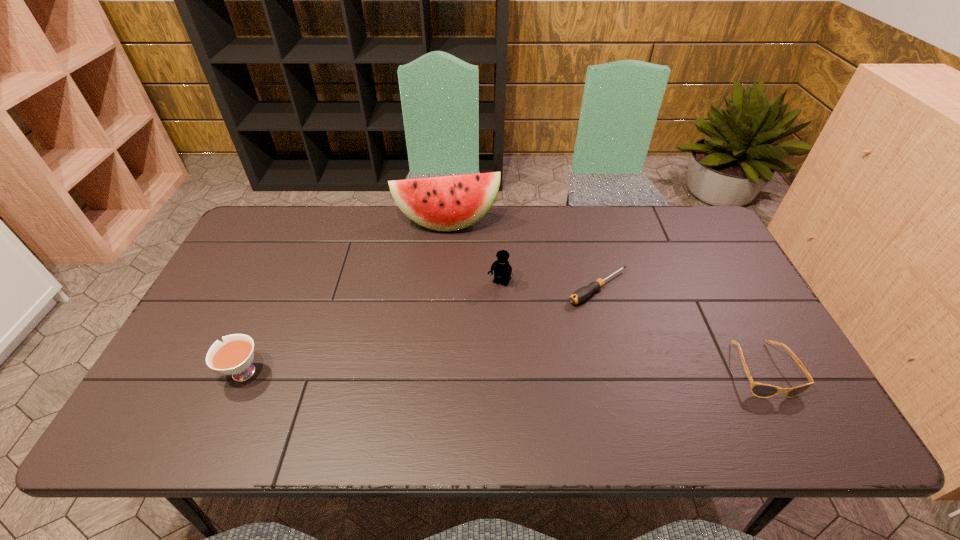
Find the location of `vacant point located on the front-facing side of the Lego`. vacant point located on the front-facing side of the Lego is located at coordinates (488, 305).

This screenshot has height=540, width=960. In order to click on free space located on the front-facing side of the Lego in this screenshot , I will do `click(458, 361)`.

At what (x,y) coordinates should I click in order to perform the action: click on vacant space situated 0.240m on the front-facing side of the Lego. Please return your answer as a coordinate pair (x, y). This screenshot has height=540, width=960. Looking at the image, I should click on (461, 355).

You are a GUI agent. You are given a task and a screenshot of the screen. Output one action in this format:
    pyautogui.click(x=<x>, y=<y>)
    Task: Click on the free region located at the tip of the screwdriver
    Image resolution: width=960 pixels, height=540 pixels.
    Given the screenshot: What is the action you would take?
    pyautogui.click(x=516, y=338)

I want to click on vacant space located at the tip of the screwdriver, so click(467, 370).

At what (x,y) coordinates should I click in order to perform the action: click on free space located 0.380m at the tip of the screwdriver. Please return your answer as a coordinate pair (x, y). This screenshot has width=960, height=540. Looking at the image, I should click on (467, 370).

This screenshot has height=540, width=960. I want to click on free region located on the outer rind of the farthest object, so click(x=454, y=266).

What are the coordinates of `free space located on the outer rind of the farthest object` in the screenshot? It's located at (454, 268).

The height and width of the screenshot is (540, 960). What are the coordinates of `vacant position located 0.350m on the outer rind of the farthest object` in the screenshot? It's located at (459, 316).

Identify the location of object situated at the far edge. (448, 203).